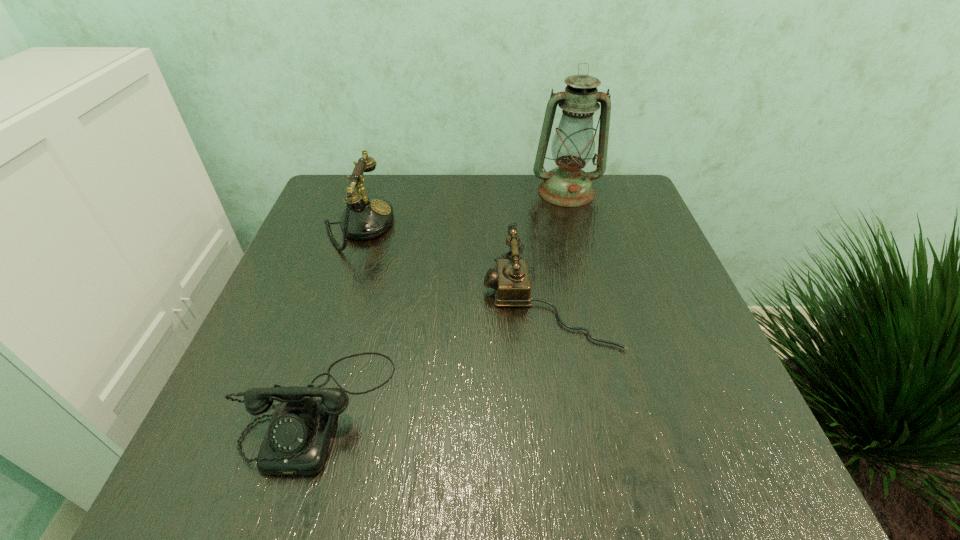
Find the location of `free space between the second shortest object and the nearest object`. free space between the second shortest object and the nearest object is located at coordinates (431, 354).

You are a GUI agent. You are given a task and a screenshot of the screen. Output one action in this format:
    pyautogui.click(x=<x>, y=<y>)
    Task: Click on the vacant area between the tallest object and the tallest telephone
    
    Given the screenshot: What is the action you would take?
    pyautogui.click(x=462, y=208)

Where is `empty location between the oil lamp and the nearest telephone`? empty location between the oil lamp and the nearest telephone is located at coordinates (441, 300).

You are a GUI agent. You are given a task and a screenshot of the screen. Output one action in this format:
    pyautogui.click(x=<x>, y=<y>)
    Task: Click on the free spot between the third tallest object and the tallest object
    This screenshot has width=960, height=540.
    Given the screenshot: What is the action you would take?
    pyautogui.click(x=557, y=246)

Identify the location of empty space that is in between the rightmost telephone and the nearest object. The height and width of the screenshot is (540, 960). (431, 354).

Identify the location of free area in between the second tallest telephone and the shortest object. The height and width of the screenshot is (540, 960). (431, 354).

Locate which object is the closest to the second nearest object. Please provide its 2D coordinates. Your answer should be formatted as a tuple, i.e. [(x, y)], where the tuple contains the x and y coordinates of a point satisfying the conditions above.

[(297, 439)]

Select which object is the third closest to the tallest telephone. Please provide its 2D coordinates. Your answer should be formatted as a tuple, i.e. [(x, y)], where the tuple contains the x and y coordinates of a point satisfying the conditions above.

[(573, 145)]

Locate which telephone is the closest to the rightmost telephone. Please provide its 2D coordinates. Your answer should be formatted as a tuple, i.e. [(x, y)], where the tuple contains the x and y coordinates of a point satisfying the conditions above.

[(297, 439)]

I want to click on telephone that is the second closest to the second shortest object, so coord(365,217).